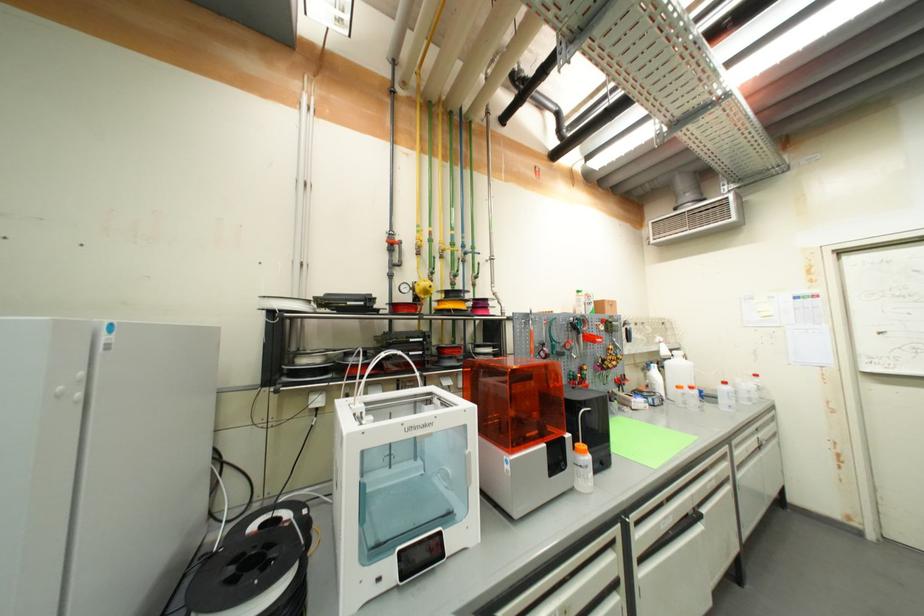
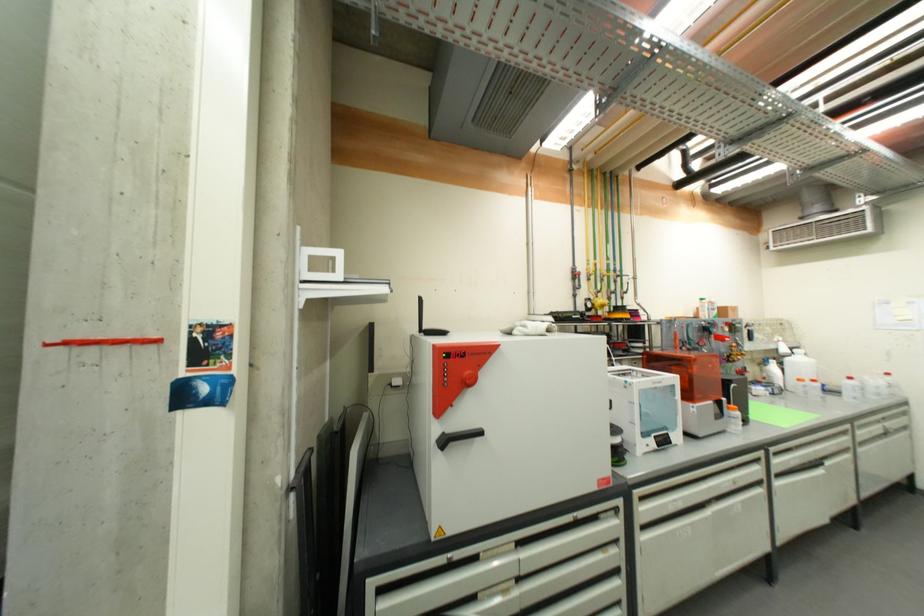
The point at (730, 385) is marked in the first image. Where is the corresponding point in the second image?

(856, 379)